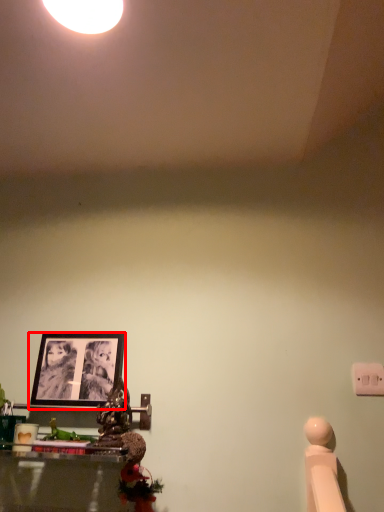
Question: From the image's perspective, what is the correct spatial positioning of picture frame (annotated by the red box) in reference to light switch?

Choices:
 (A) above
 (B) below

Answer: (A)